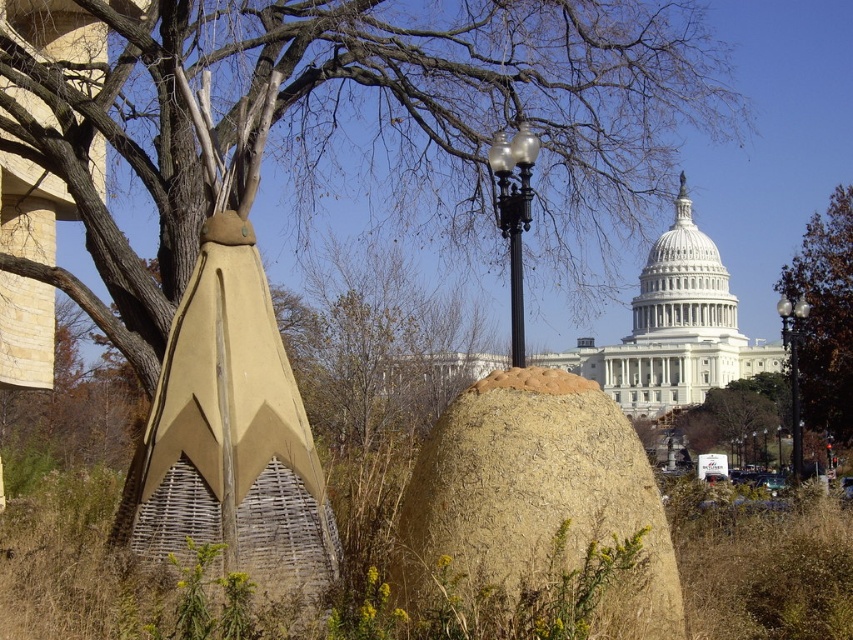
You are standing in the scene and want to place a small flag exactly at the center of the brown textured mound at center. Given that the scene is represented on a coordinate system where the bottom left corner is the origin, can you confirm the coordinates where you should place the flag?

The coordinates for the center of the brown textured mound at center are at point (537, 500), so you should place the flag at those coordinates.

You are a photographer standing at the base of the Capitol building and want to capture a photo that includes both the brown textured tree at upper right and the teepees in the foreground. Given the distance of the tree from the camera, will you be able to fit both elements into a single frame without moving your position?

The brown textured tree at upper right is 390.42 feet from the camera. Since the teepees are in the foreground closer to the photographer, and the tree is much farther away, it is possible to include both in a single frame by adjusting the camera angle or zoom level to encompass both near and distant elements.

You are an architect analyzing the spatial arrangement of the scene. Which object is positioned lower in the image, the tan wicker sculpture at left or the brown textured tree at upper right?

The tan wicker sculpture at left is located below the brown textured tree at upper right, so it is positioned lower in the image.